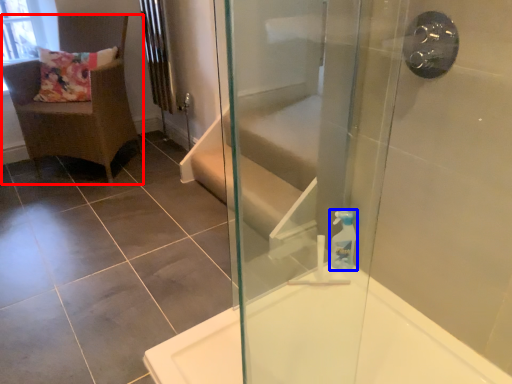
Question: Which point is closer to the camera, chair (highlighted by a red box) or soap dispenser (highlighted by a blue box)?

Choices:
 (A) chair
 (B) soap dispenser

Answer: (B)